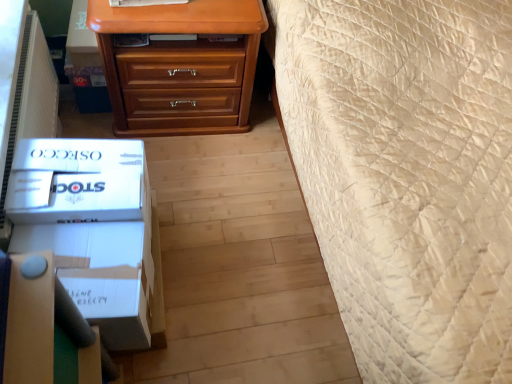
Locate an element on the screen. The height and width of the screenshot is (384, 512). free space above white cardboard box at lower left, which is the first box in top-to-bottom order (from a real-world perspective) is located at coordinates (72, 167).